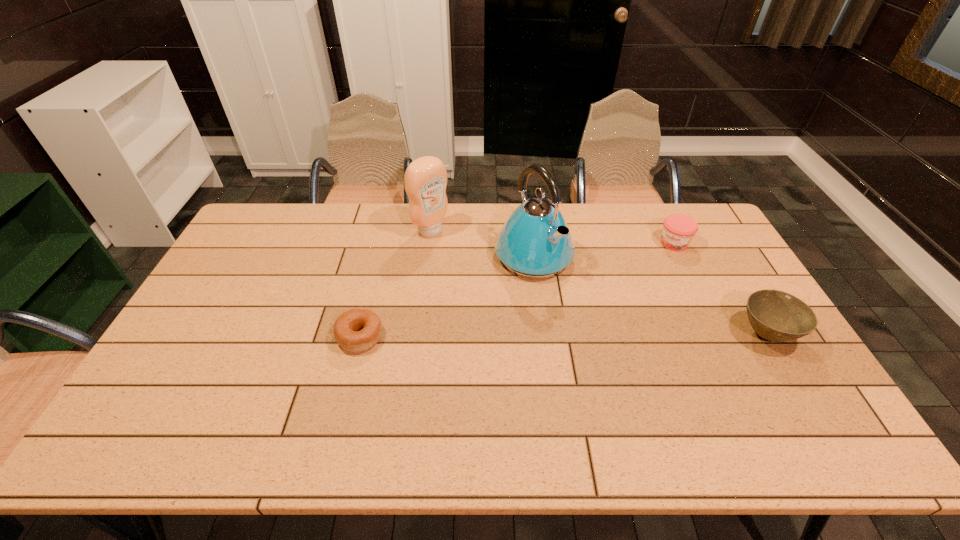
The width and height of the screenshot is (960, 540). I want to click on vacant point that satisfies the following two spatial constraints: 1. on the back side of the shortest object; 2. on the left side of the tallest object, so click(x=380, y=255).

This screenshot has height=540, width=960. Find the location of `vacant space that satisfies the following two spatial constraints: 1. on the back side of the condiment; 2. on the right side of the shortest object`. vacant space that satisfies the following two spatial constraints: 1. on the back side of the condiment; 2. on the right side of the shortest object is located at coordinates (387, 231).